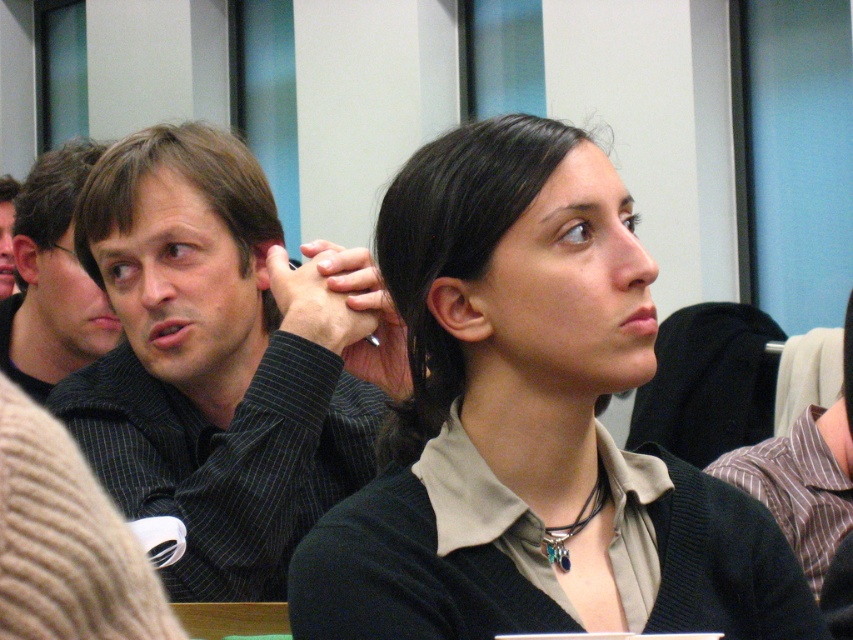
Question: Which object is positioned closest to the dark gray striped shirt at center?

Choices:
 (A) matte black shirt at upper left
 (B) matte black sweater at center
 (C) dark gray striped shirt at left

Answer: (C)

Question: Where is matte black sweater at center located in relation to dark gray striped shirt at left in the image?

Choices:
 (A) below
 (B) above

Answer: (A)

Question: Does matte black sweater at center appear on the left side of matte black shirt at upper left?

Choices:
 (A) yes
 (B) no

Answer: (B)

Question: Which object is positioned farthest from the matte black sweater at center?

Choices:
 (A) matte black shirt at upper left
 (B) dark gray striped shirt at center
 (C) dark gray striped shirt at left

Answer: (A)

Question: Which of the following is the farthest from the observer?

Choices:
 (A) dark gray striped shirt at center
 (B) matte black sweater at center

Answer: (A)

Question: Does matte black sweater at center appear on the right side of dark gray striped shirt at center?

Choices:
 (A) yes
 (B) no

Answer: (A)